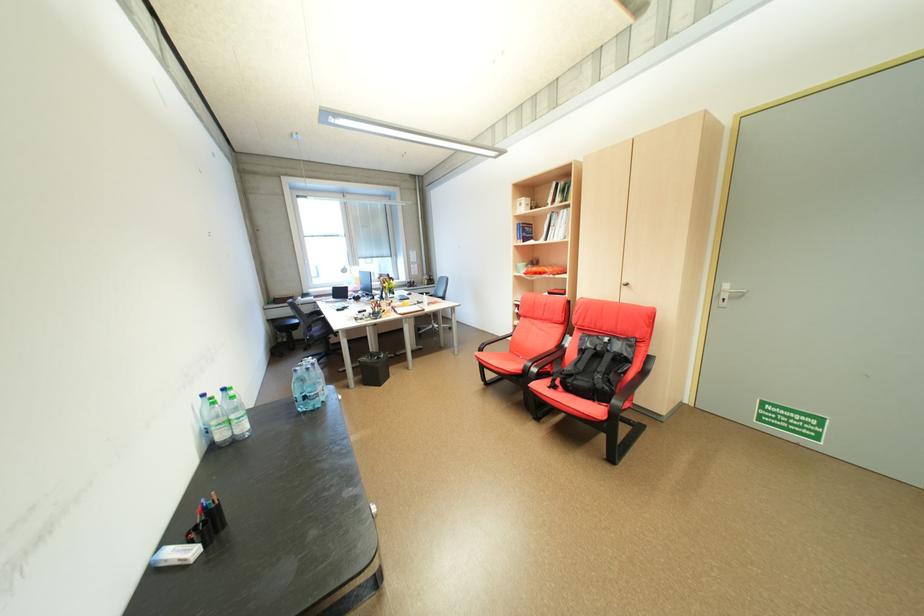
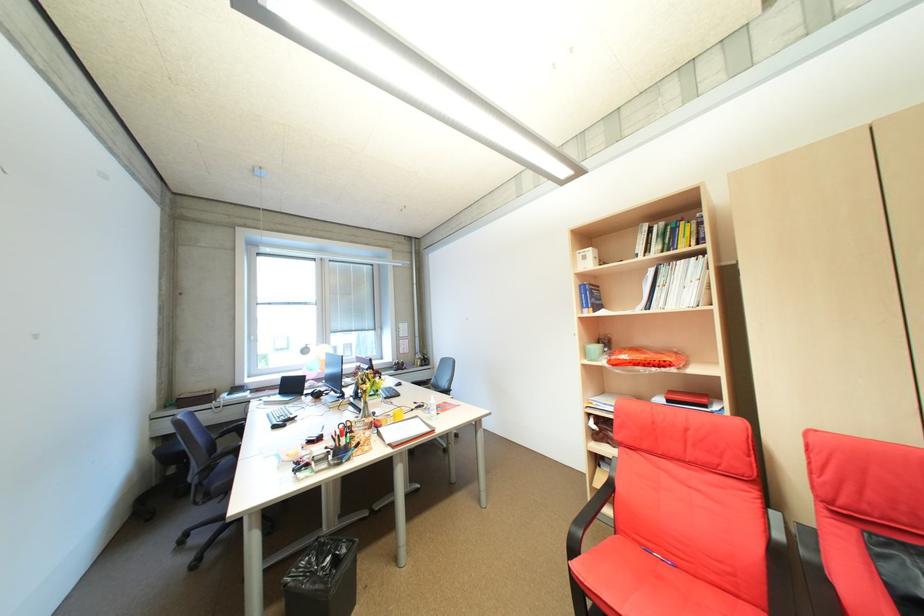
In the second image, find the point that corresponds to [525,269] in the first image.

(593, 353)